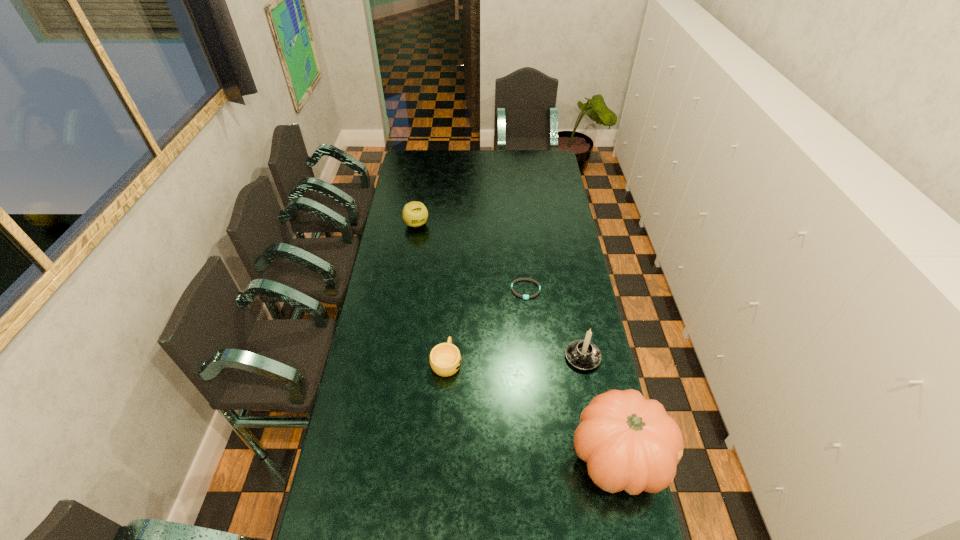
Image resolution: width=960 pixels, height=540 pixels. Find the location of `free space on the desktop that is between the fourth tallest object and the pumpkin and is positioned on the buckle of the third object from left to right`. free space on the desktop that is between the fourth tallest object and the pumpkin and is positioned on the buckle of the third object from left to right is located at coordinates (550, 418).

Image resolution: width=960 pixels, height=540 pixels. I want to click on vacant space on the desktop that is between the second shortest object and the nearest object and is positioned on the logo side of the farthest object, so click(x=506, y=395).

Image resolution: width=960 pixels, height=540 pixels. Identify the location of free space on the desktop that is between the cup and the pumpkin and is positioned with a handle on the side of the candle holder. (514, 399).